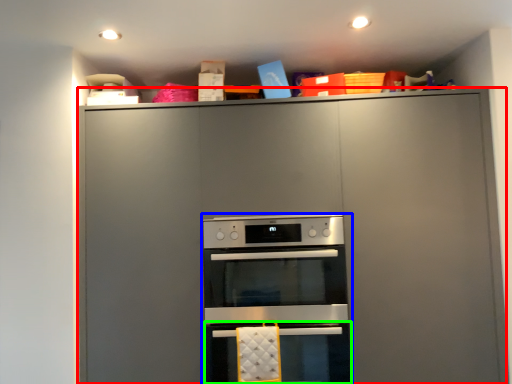
Question: Estimate the real-world distances between objects in this image. Which object is closer to cabinetry (highlighted by a red box), oven (highlighted by a blue box) or oven (highlighted by a green box)?

Choices:
 (A) oven
 (B) oven

Answer: (A)